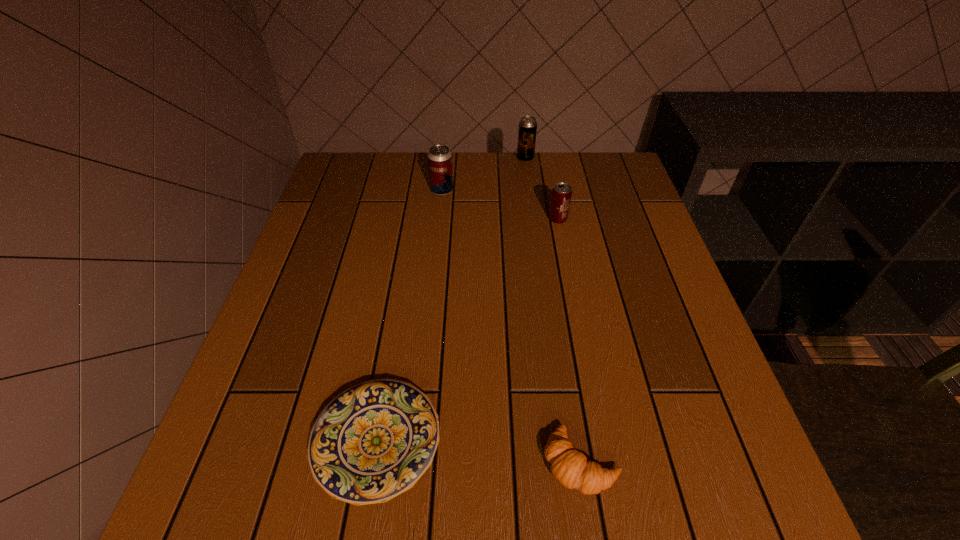
Identify the location of the farthest beer can. This screenshot has height=540, width=960. tap(527, 130).

You are a GUI agent. You are given a task and a screenshot of the screen. Output one action in this format:
    pyautogui.click(x=<x>, y=<y>)
    Task: Click on the second beer can from right to left
    The width and height of the screenshot is (960, 540).
    Given the screenshot: What is the action you would take?
    pyautogui.click(x=527, y=130)

Locate an element on the screen. the second nearest beer can is located at coordinates (439, 157).

I want to click on the leftmost beer can, so click(439, 157).

Locate an element on the screen. the shortest beer can is located at coordinates (561, 195).

This screenshot has height=540, width=960. I want to click on the nearest beer can, so click(561, 195).

Identify the location of crescent roll. This screenshot has height=540, width=960. (569, 466).

Locate an element on the screen. This screenshot has height=540, width=960. plate is located at coordinates (373, 441).

The image size is (960, 540). I want to click on vacant space located 0.090m on the left of the farthest beer can, so point(487,158).

The height and width of the screenshot is (540, 960). I want to click on vacant position located on the right of the second farthest beer can, so click(x=471, y=191).